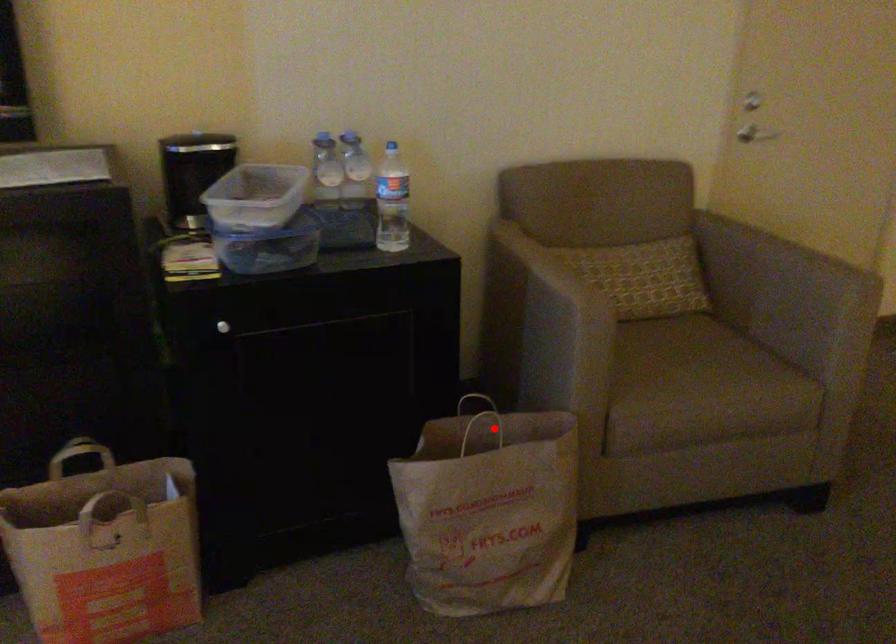
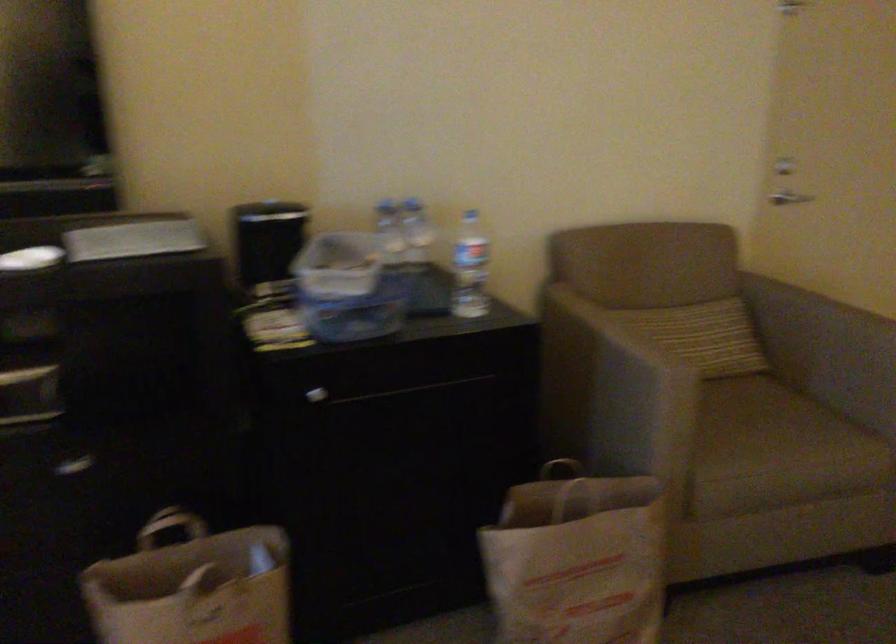
Find the pixel in the second image that matches the highlighted location in the first image.

(576, 493)